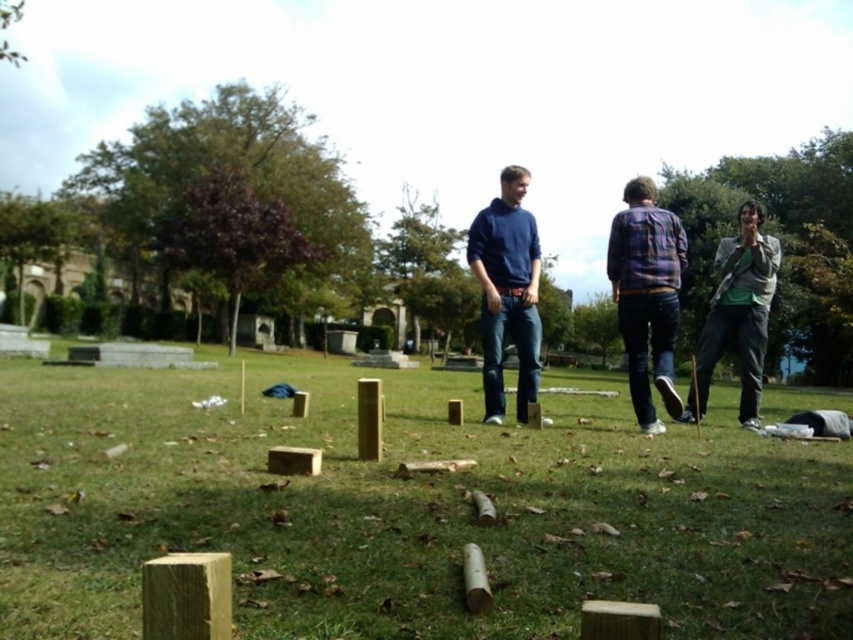
Question: Among these points, which one is nearest to the camera?

Choices:
 (A) (763, 289)
 (B) (482, 262)
 (C) (608, 257)
 (D) (206, 499)

Answer: (D)

Question: Estimate the real-world distances between objects in this image. Which object is closer to the green fabric jacket at right?

Choices:
 (A) matte blue sweater at center
 (B) green grass at center

Answer: (A)

Question: Can you confirm if green grass at center is thinner than matte blue sweater at center?

Choices:
 (A) no
 (B) yes

Answer: (A)

Question: Does green grass at center have a lesser width compared to matte blue sweater at center?

Choices:
 (A) no
 (B) yes

Answer: (A)

Question: Which is farther from the green fabric jacket at right?

Choices:
 (A) plaid fabric shirt at center
 (B) matte blue sweater at center
 (C) green grass at center

Answer: (C)

Question: Is green grass at center thinner than green fabric jacket at right?

Choices:
 (A) no
 (B) yes

Answer: (A)